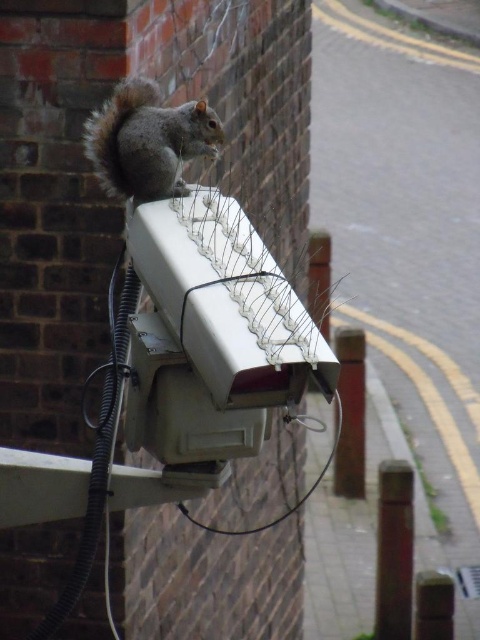
Locate an element on the screen. gray furry squirrel at upper center is located at coordinates (146, 141).

Where is `gray furry squirrel at upper center`? gray furry squirrel at upper center is located at coordinates (146, 141).

This screenshot has height=640, width=480. I want to click on metallic pole at center, so click(350, 413).

Can you confirm if metallic pole at center is positioned to the left of metallic wire at upper center?

No, metallic pole at center is not to the left of metallic wire at upper center.

The width and height of the screenshot is (480, 640). I want to click on metallic pole at center, so click(x=350, y=413).

Identify the location of metallic pole at center. Image resolution: width=480 pixels, height=640 pixels. (350, 413).

Is smooth brown pole at lower right positioned in front of metallic wire at upper center?

No, smooth brown pole at lower right is behind metallic wire at upper center.

Consider the image. Between smooth brown pole at lower right and metallic wire at upper center, which one has less height?

metallic wire at upper center

Does point (379, 545) lie behind point (319, 253)?

No, (379, 545) is in front of (319, 253).

The image size is (480, 640). I want to click on smooth brown pole at lower right, so click(x=394, y=550).